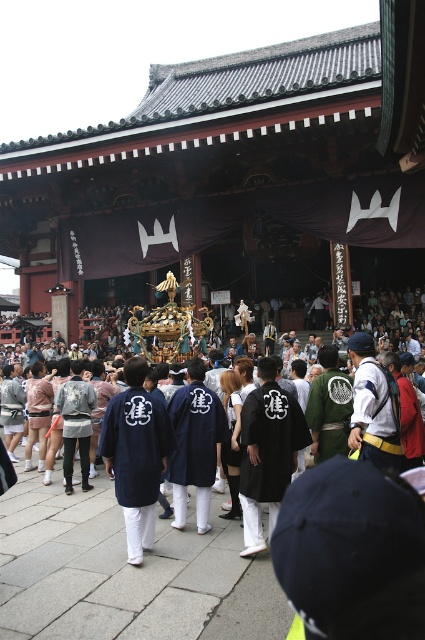
You are a photographer at the festival and want to capture both the navy blue fabric robe at center and the black matte robe at center in the same frame. Which robe should you focus on first to ensure both are in the shot?

The navy blue fabric robe at center is positioned under the black matte robe at center, so you should focus on the black matte robe at center first to ensure both are visible in the frame.

You are a photographer at the festival. You need to capture a photo of the navy blue fabric robe at center and the black matte robe at center. Which robe will have its hem visible in the photo if both are standing side by side?

The navy blue fabric robe at center is shorter than the black matte robe at center, so its hem will be visible in the photo.

Based on the photo, you are standing at the point marked as point [113,467] in the image. The festival organizers have placed a safety barrier 20 meters away from this point towards the temple entrance. Will the barrier be within the 20.90 meters distance specified in the description?

Yes, the safety barrier placed 20 meters from point [113,467] is within the 20.90 meters specified distance.